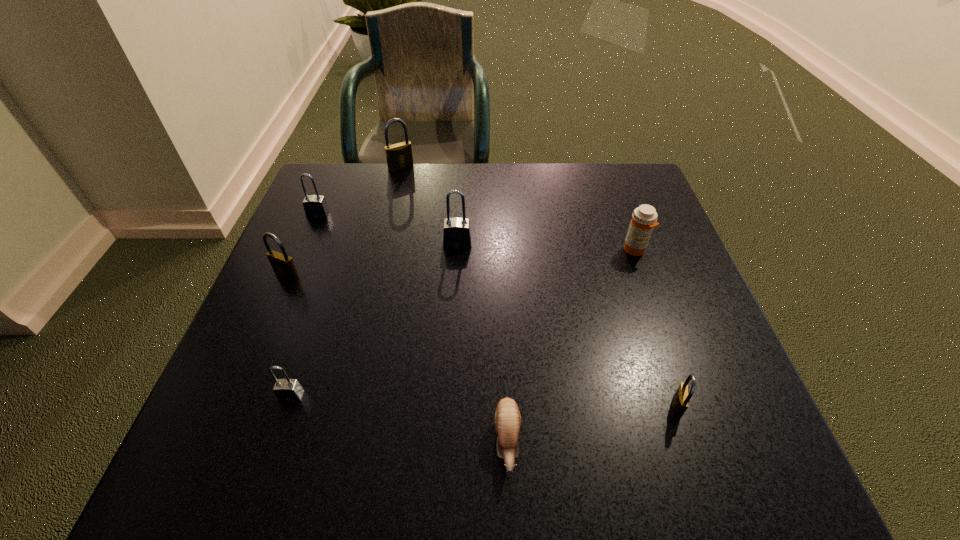
You are a GUI agent. You are given a task and a screenshot of the screen. Output one action in this format:
    pyautogui.click(x=<x>, y=<y>)
    Task: Click on the free space between the second farthest padlock and the third padlock from right to left
    
    Given the screenshot: What is the action you would take?
    pyautogui.click(x=360, y=191)

Locate an element on the screen. Image resolution: width=960 pixels, height=540 pixels. empty space between the second smallest brass padlock and the rightmost brass padlock is located at coordinates (482, 341).

Image resolution: width=960 pixels, height=540 pixels. What are the coordinates of `the fourth closest object to the second padlock from right to left` in the screenshot? It's located at (644, 218).

You are a GUI agent. You are given a task and a screenshot of the screen. Output one action in this format:
    pyautogui.click(x=<x>, y=<y>)
    Task: Click on the object identified as the fourth closest to the farthest brass padlock
    
    Given the screenshot: What is the action you would take?
    pyautogui.click(x=644, y=218)

Where is `padlock that is the fifth closest one to the smallest gray padlock`? This screenshot has height=540, width=960. padlock that is the fifth closest one to the smallest gray padlock is located at coordinates (399, 157).

The width and height of the screenshot is (960, 540). I want to click on padlock that is the nearest to the nearest brass padlock, so click(x=457, y=232).

Select which brass padlock is the closest to the orange medicine. Please provide its 2D coordinates. Your answer should be formatted as a tuple, i.e. [(x, y)], where the tuple contains the x and y coordinates of a point satisfying the conditions above.

[(680, 402)]

Locate which brass padlock is the second closest to the second smallest brass padlock. Please provide its 2D coordinates. Your answer should be formatted as a tuple, i.e. [(x, y)], where the tuple contains the x and y coordinates of a point satisfying the conditions above.

[(680, 402)]

Identify which gray padlock is the second closest to the rightmost padlock. Please provide its 2D coordinates. Your answer should be formatted as a tuple, i.e. [(x, y)], where the tuple contains the x and y coordinates of a point satisfying the conditions above.

[(288, 390)]

Locate which gray padlock is the third closest to the third padlock from right to left. Please provide its 2D coordinates. Your answer should be formatted as a tuple, i.e. [(x, y)], where the tuple contains the x and y coordinates of a point satisfying the conditions above.

[(288, 390)]